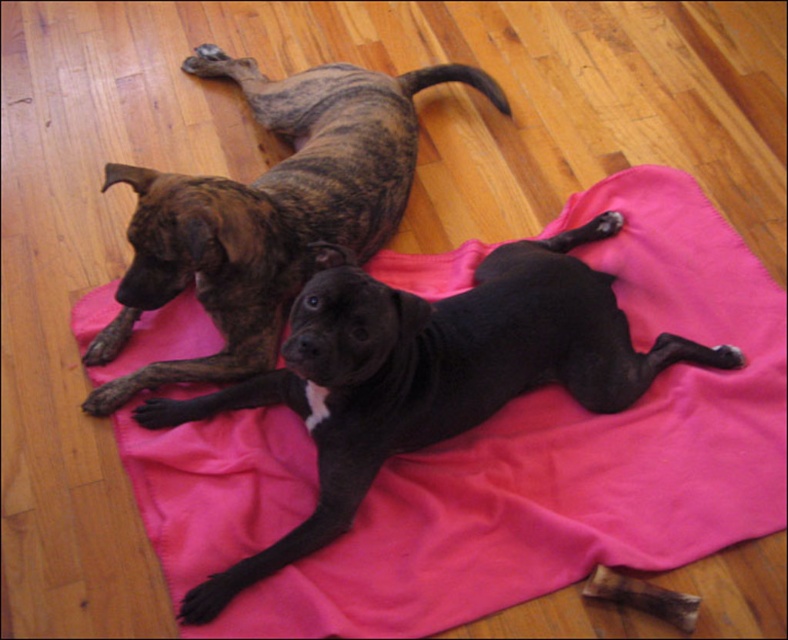
You are a photographer setting up a shoot in the scene. You need to place a small light source between the black smooth dog at center and the brindle fur dog at upper left. Based on their positions, where should you position the light so it is between them?

The light should be placed between the black smooth dog at center and the brindle fur dog at upper left, closer to the black smooth dog at center since it is positioned under the brindle fur dog at upper left.

You are a dog owner who wants to buy a new dog bed that fits both your black smooth dog at center and brindle fur dog at upper left. Based on their sizes, which dog requires a larger bed?

The black smooth dog at center requires a larger bed since it is wider than the brindle fur dog at upper left.

You are a toy placed on the wooden floor. You want to roll to the black smooth dog at center and then to the brindle fur dog at upper left. Can you reach both without moving more than 15 inches from your starting position?

The distance between the black smooth dog at center and the brindle fur dog at upper left is 14.04 inches. Since 14.04 inches is less than 15 inches, you can roll to both dogs without exceeding the 15 inch limit.